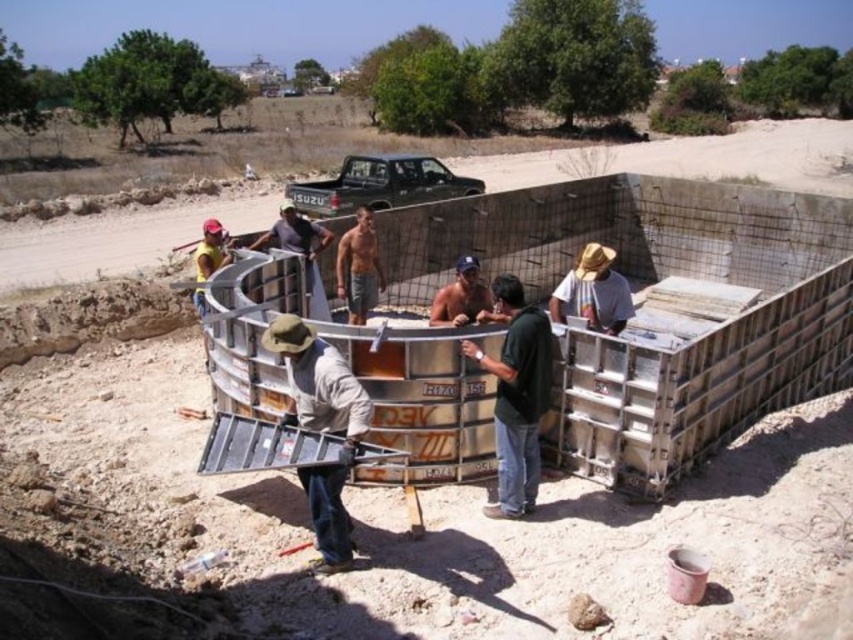
Question: Which of the following is the closest to the observer?

Choices:
 (A) shiny metallic shirt at center
 (B) shiny metallic helmet at center
 (C) matte silver tank at center

Answer: (C)

Question: Considering the relative positions of green matte shirt at center and shiny metallic helmet at center in the image provided, where is green matte shirt at center located with respect to shiny metallic helmet at center?

Choices:
 (A) above
 (B) below

Answer: (B)

Question: Does green matte shirt at center lie in front of matte black truck at upper center?

Choices:
 (A) yes
 (B) no

Answer: (A)

Question: Which point is closer to the camera?

Choices:
 (A) (294, 198)
 (B) (431, 307)
 (C) (292, 244)

Answer: (C)

Question: Does light brown fabric shirt at center appear over shiny metallic helmet at center?

Choices:
 (A) no
 (B) yes

Answer: (A)

Question: Which point is closer to the camera?

Choices:
 (A) (519, 497)
 (B) (456, 260)
 (C) (294, 234)
 (D) (346, 193)

Answer: (A)